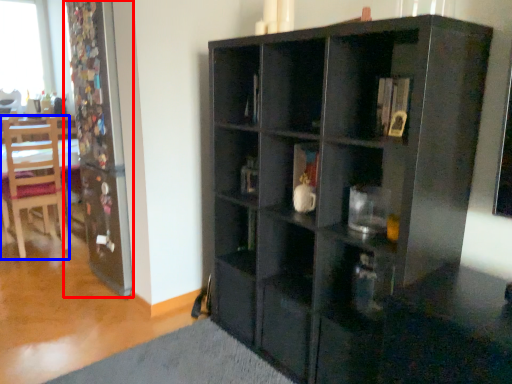
Question: Among these objects, which one is farthest to the camera, screen door (highlighted by a red box) or chair (highlighted by a blue box)?

Choices:
 (A) screen door
 (B) chair

Answer: (B)